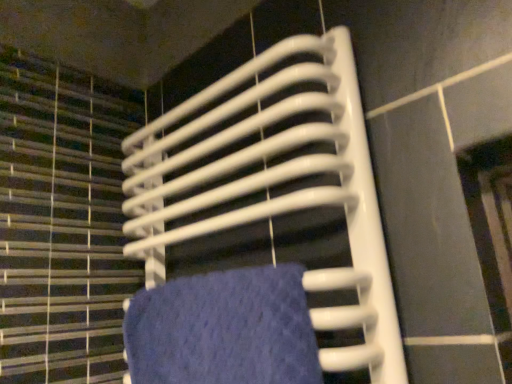
Question: Should I look upward or downward to see white plastic grille at upper center?

Choices:
 (A) down
 (B) up

Answer: (A)